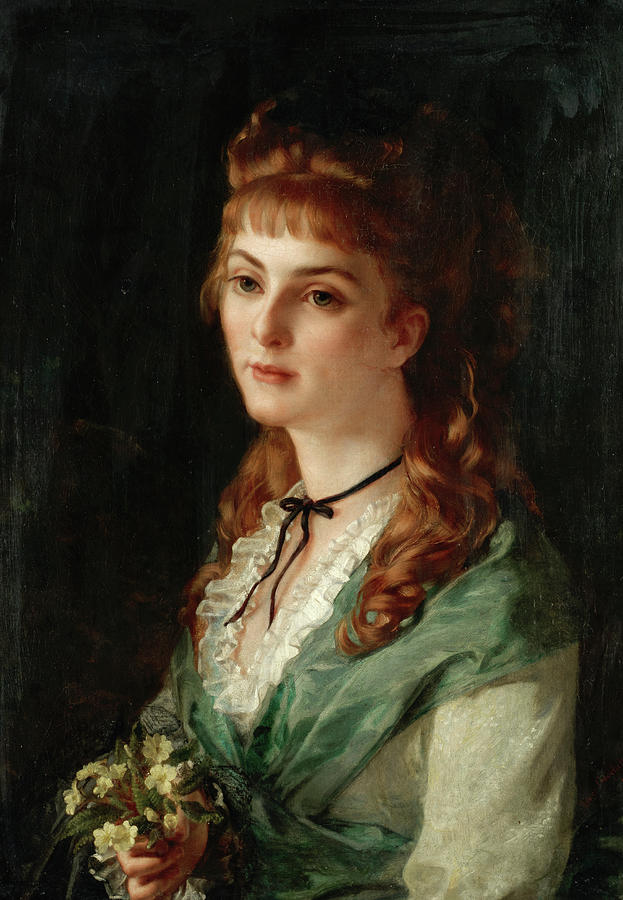
The height and width of the screenshot is (900, 623). Find the location of `art gallery`. art gallery is located at coordinates (506, 763).